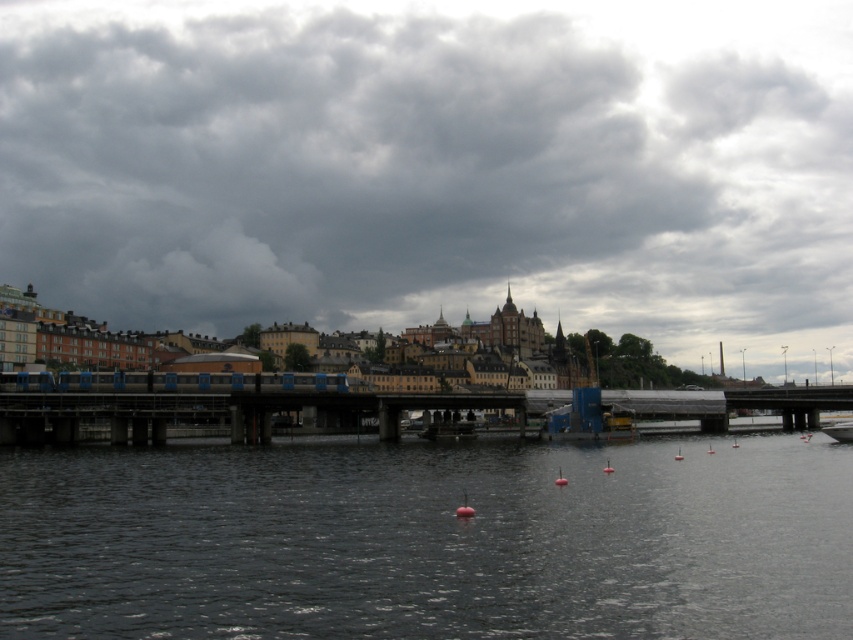
Between point (15, 612) and point (354, 410), which one is positioned behind?

The point (354, 410) is more distant.

Who is lower down, dark water at center or metallic gray bridge at center?

metallic gray bridge at center is lower down.

Which is in front, point (285, 522) or point (10, 381)?

Positioned in front is point (285, 522).

The width and height of the screenshot is (853, 640). Find the location of `dark water at center`. dark water at center is located at coordinates (428, 540).

Does point (621, 452) come farther from viewer compared to point (842, 428)?

That is True.

Which is in front, point (460, 547) or point (830, 429)?

Point (460, 547)

The width and height of the screenshot is (853, 640). Find the location of `dark water at center`. dark water at center is located at coordinates (428, 540).

Which is more to the left, metallic gray bridge at center or white plastic boat at lower right?

metallic gray bridge at center is more to the left.

Which of these two, metallic gray bridge at center or white plastic boat at lower right, stands shorter?

With less height is white plastic boat at lower right.

Locate an element on the screen. The width and height of the screenshot is (853, 640). metallic gray bridge at center is located at coordinates (222, 404).